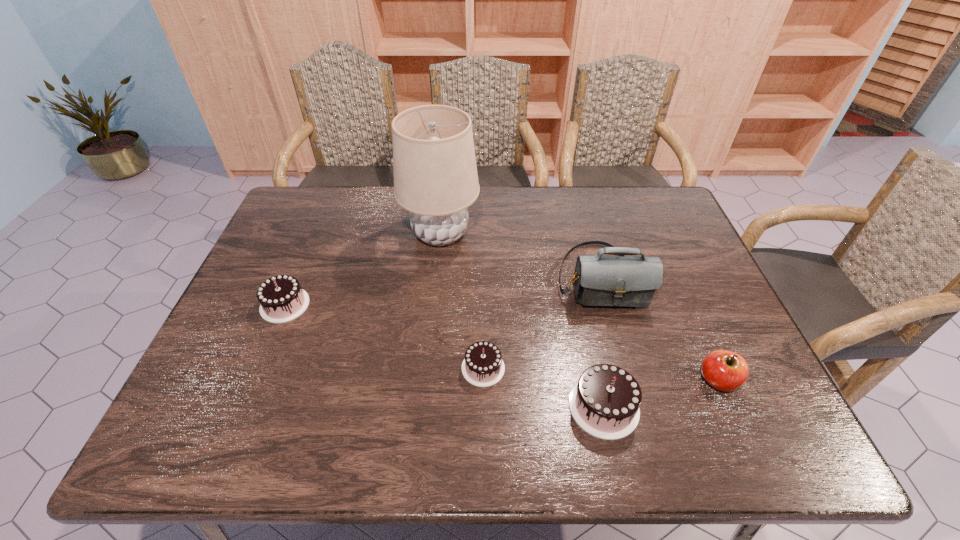
The height and width of the screenshot is (540, 960). I want to click on free space located on the back of the tallest chocolate cake, so click(583, 308).

Where is `vacant region located on the left of the tallest object`? This screenshot has height=540, width=960. vacant region located on the left of the tallest object is located at coordinates (353, 234).

Locate an element on the screen. The width and height of the screenshot is (960, 540). vacant area located 0.190m on the left of the second tallest object is located at coordinates (490, 277).

Find the location of a particular element. The height and width of the screenshot is (540, 960). vacant space situated 0.230m on the left of the apple is located at coordinates (596, 380).

Locate an element on the screen. object that is positioned at the far edge is located at coordinates (435, 175).

At what (x,y) coordinates should I click in order to perform the action: click on apple situated at the near edge. Please return your answer as a coordinate pair (x, y). The width and height of the screenshot is (960, 540). Looking at the image, I should click on (724, 370).

Where is `object at the left edge`? object at the left edge is located at coordinates coord(281,298).

You are a GUI agent. You are given a task and a screenshot of the screen. Output one action in this format:
    pyautogui.click(x=<x>, y=<y>)
    Task: Click on the object that is at the right edge
    The height and width of the screenshot is (540, 960).
    Given the screenshot: What is the action you would take?
    click(x=724, y=370)

Where is `object that is positioned at the near right corner`? object that is positioned at the near right corner is located at coordinates (724, 370).

Locate an element on the screen. Image resolution: width=960 pixels, height=540 pixels. vacant space at the far edge of the desktop is located at coordinates (622, 220).